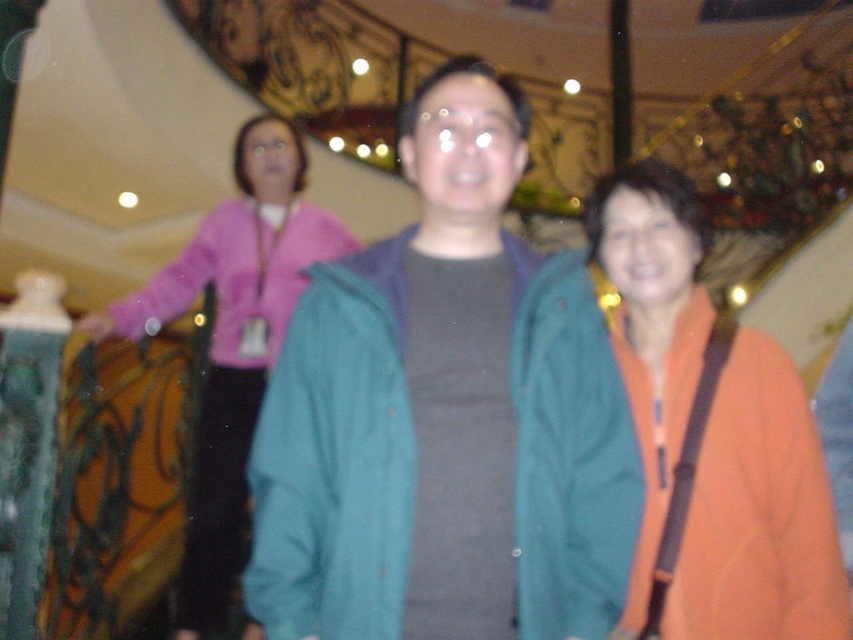
Question: Is teal fabric jacket at center closer to the viewer compared to pink fabric jacket at upper left?

Choices:
 (A) no
 (B) yes

Answer: (B)

Question: Is orange fabric at right above pink fabric at upper left?

Choices:
 (A) no
 (B) yes

Answer: (B)

Question: Estimate the real-world distances between objects in this image. Which object is closer to the orange fabric at right?

Choices:
 (A) pink fabric jacket at upper left
 (B) teal fabric jacket at center

Answer: (B)

Question: Which object is closer to the camera taking this photo?

Choices:
 (A) orange fabric at right
 (B) pink fabric at upper left
 (C) pink fabric jacket at upper left
 (D) teal fabric jacket at center

Answer: (D)

Question: Is teal fabric jacket at center thinner than pink fabric jacket at upper left?

Choices:
 (A) no
 (B) yes

Answer: (B)

Question: Which object appears farthest from the camera in this image?

Choices:
 (A) teal fabric jacket at center
 (B) orange fabric at right
 (C) pink fabric jacket at upper left
 (D) pink fabric at upper left

Answer: (C)